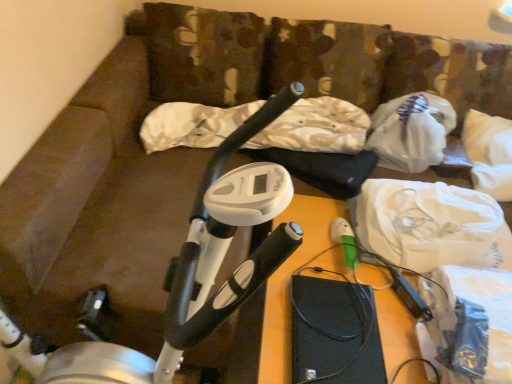
Question: Is white plastic bag at upper right taller than white fabric at upper right?

Choices:
 (A) yes
 (B) no

Answer: (A)

Question: Considering the relative positions of white plastic bag at upper right and white fabric at upper right in the image provided, is white plastic bag at upper right to the right of white fabric at upper right from the viewer's perspective?

Choices:
 (A) yes
 (B) no

Answer: (A)

Question: Is white plastic bag at upper right in contact with white fabric at upper right?

Choices:
 (A) no
 (B) yes

Answer: (A)

Question: Is the depth of white plastic bag at upper right greater than that of white fabric at upper right?

Choices:
 (A) yes
 (B) no

Answer: (A)

Question: Is white plastic bag at upper right shorter than white fabric at upper right?

Choices:
 (A) yes
 (B) no

Answer: (B)

Question: In the image, is white plastic bag at upper right positioned in front of or behind white plastic stationary bicycle at left?

Choices:
 (A) front
 (B) behind

Answer: (B)

Question: Which is correct: white plastic bag at upper right is inside white plastic stationary bicycle at left, or outside of it?

Choices:
 (A) outside
 (B) inside

Answer: (A)

Question: Is point (408, 100) positioned closer to the camera than point (229, 203)?

Choices:
 (A) closer
 (B) farther

Answer: (B)

Question: Visually, is white plastic bag at upper right positioned to the left or to the right of white plastic stationary bicycle at left?

Choices:
 (A) right
 (B) left

Answer: (A)

Question: From a real-world perspective, is white plastic stationary bicycle at left above or below white plastic bag at upper right?

Choices:
 (A) below
 (B) above

Answer: (B)

Question: Is point (257, 210) positioned closer to the camera than point (372, 127)?

Choices:
 (A) closer
 (B) farther

Answer: (A)

Question: Would you say white plastic stationary bicycle at left is inside or outside white plastic bag at upper right?

Choices:
 (A) inside
 (B) outside

Answer: (B)

Question: Considering the positions of white plastic stationary bicycle at left and white plastic bag at upper right in the image, is white plastic stationary bicycle at left taller or shorter than white plastic bag at upper right?

Choices:
 (A) short
 (B) tall

Answer: (B)

Question: Based on their sizes in the image, would you say white fabric at upper right is bigger or smaller than white plastic bag at upper right?

Choices:
 (A) small
 (B) big

Answer: (B)

Question: From the image's perspective, is white fabric at upper right above or below white plastic bag at upper right?

Choices:
 (A) above
 (B) below

Answer: (B)